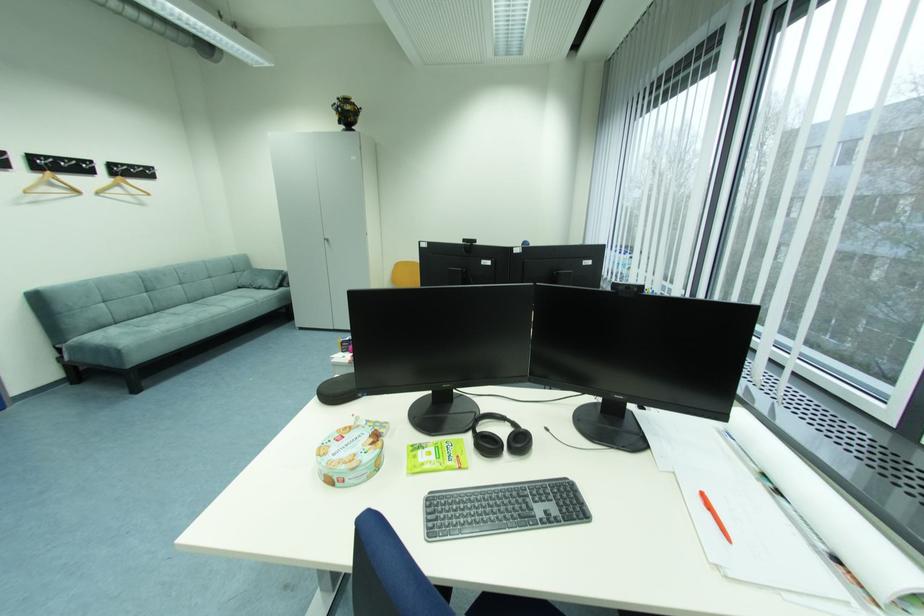
Where would you lift the green snack packet? Please return your answer as a coordinate pair (x, y).

(435, 456)